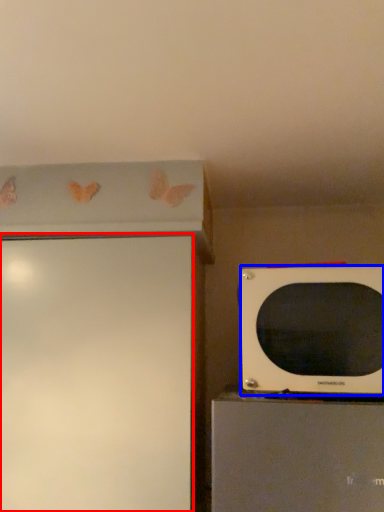
Question: Which object appears farthest to the camera in this image, screen door (highlighted by a red box) or microwave oven (highlighted by a blue box)?

Choices:
 (A) screen door
 (B) microwave oven

Answer: (A)